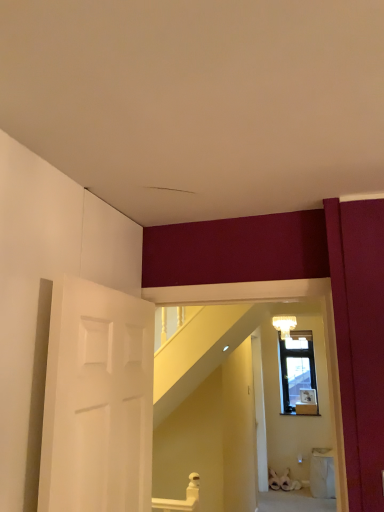
Question: Is white frosted glass light fixture at upper center positioned with its back to white matte door at center?

Choices:
 (A) no
 (B) yes

Answer: (A)

Question: Considering the relative sizes of white frosted glass light fixture at upper center and white matte door at center in the image provided, is white frosted glass light fixture at upper center bigger than white matte door at center?

Choices:
 (A) no
 (B) yes

Answer: (A)

Question: Considering the relative sizes of white frosted glass light fixture at upper center and white matte door at center in the image provided, is white frosted glass light fixture at upper center shorter than white matte door at center?

Choices:
 (A) yes
 (B) no

Answer: (A)

Question: Does white frosted glass light fixture at upper center touch white matte door at center?

Choices:
 (A) no
 (B) yes

Answer: (A)

Question: Is white frosted glass light fixture at upper center not inside white matte door at center?

Choices:
 (A) yes
 (B) no

Answer: (A)

Question: Is white frosted glass light fixture at upper center at the left side of white matte door at center?

Choices:
 (A) yes
 (B) no

Answer: (B)

Question: From the image's perspective, is white matte door at center on top of white frosted glass light fixture at upper center?

Choices:
 (A) yes
 (B) no

Answer: (B)

Question: Considering the relative sizes of white matte door at center and white frosted glass light fixture at upper center in the image provided, is white matte door at center taller than white frosted glass light fixture at upper center?

Choices:
 (A) yes
 (B) no

Answer: (A)

Question: Considering the relative sizes of white matte door at center and white frosted glass light fixture at upper center in the image provided, is white matte door at center thinner than white frosted glass light fixture at upper center?

Choices:
 (A) no
 (B) yes

Answer: (B)

Question: From a real-world perspective, is white matte door at center over white frosted glass light fixture at upper center?

Choices:
 (A) yes
 (B) no

Answer: (B)

Question: Is white matte door at center positioned before white frosted glass light fixture at upper center?

Choices:
 (A) no
 (B) yes

Answer: (B)

Question: From the image's perspective, is white matte door at center under white frosted glass light fixture at upper center?

Choices:
 (A) yes
 (B) no

Answer: (A)

Question: Considering the positions of point (253, 335) and point (296, 325), is point (253, 335) closer or farther from the camera than point (296, 325)?

Choices:
 (A) farther
 (B) closer

Answer: (B)